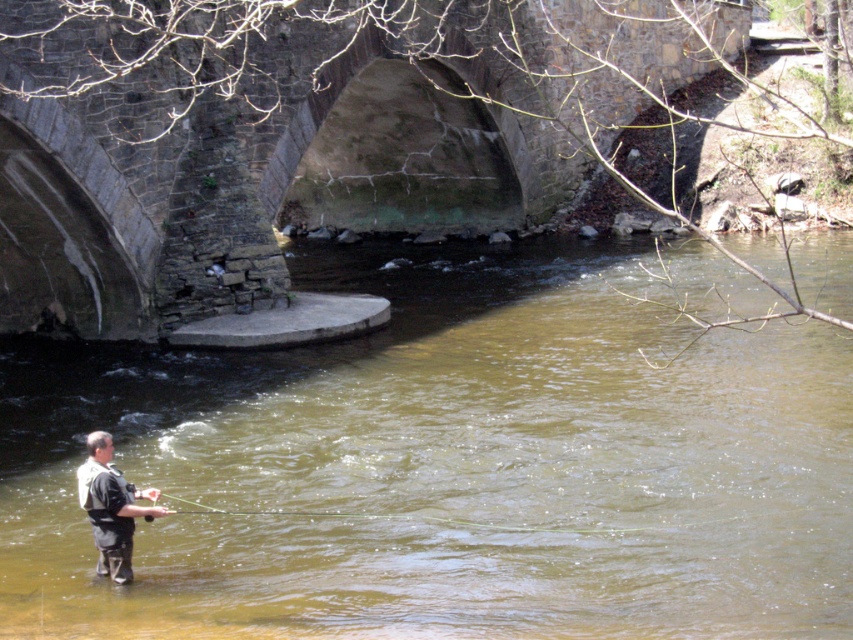
Can you confirm if brown murky water at center is smaller than dark gray fabric waders at lower left?

Actually, brown murky water at center might be larger than dark gray fabric waders at lower left.

Is brown murky water at center to the right of dark gray fabric waders at lower left from the viewer's perspective?

Yes, brown murky water at center is to the right of dark gray fabric waders at lower left.

The width and height of the screenshot is (853, 640). Describe the element at coordinates (448, 465) in the screenshot. I see `brown murky water at center` at that location.

Locate an element on the screen. The image size is (853, 640). brown murky water at center is located at coordinates (448, 465).